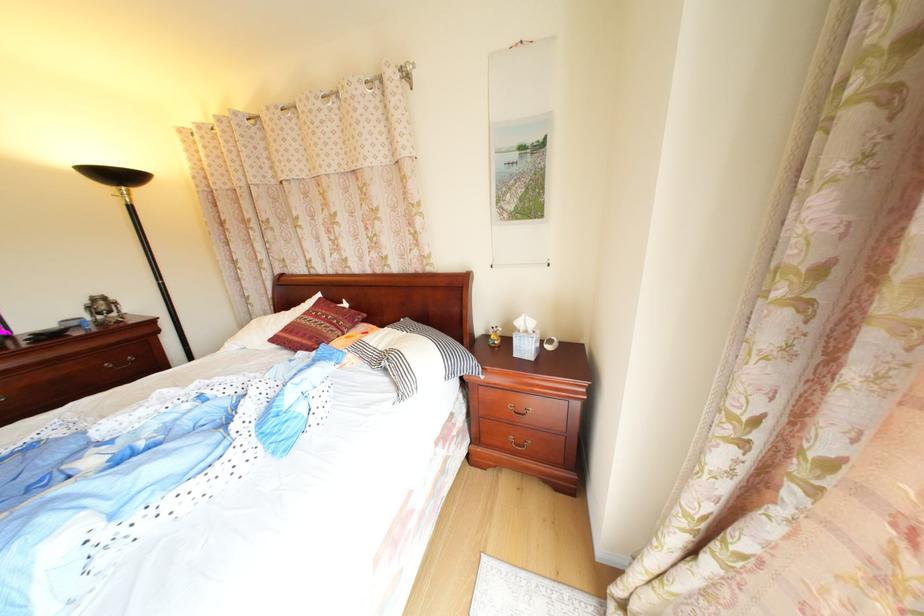
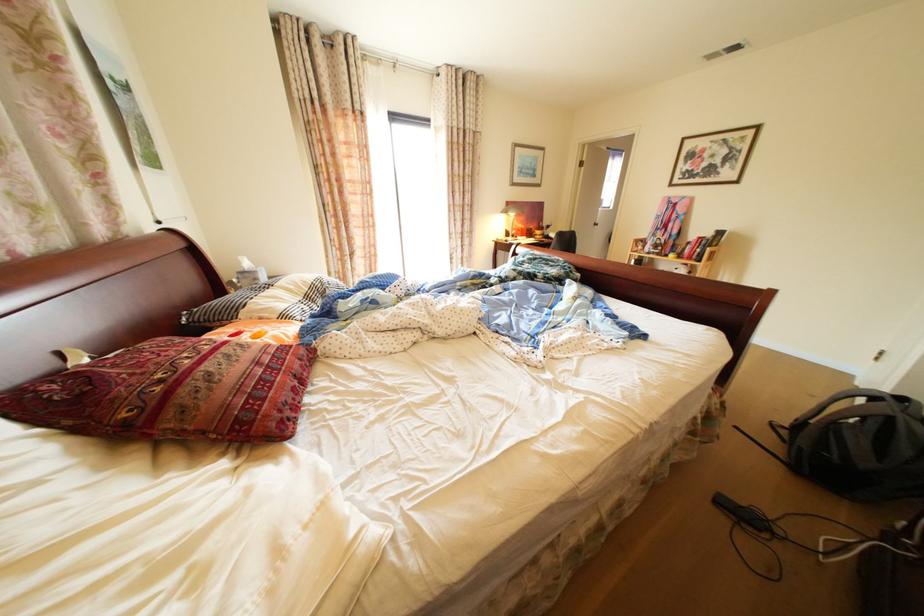
Locate, in the second image, the point that corresponds to point (304, 342) in the first image.

(309, 378)